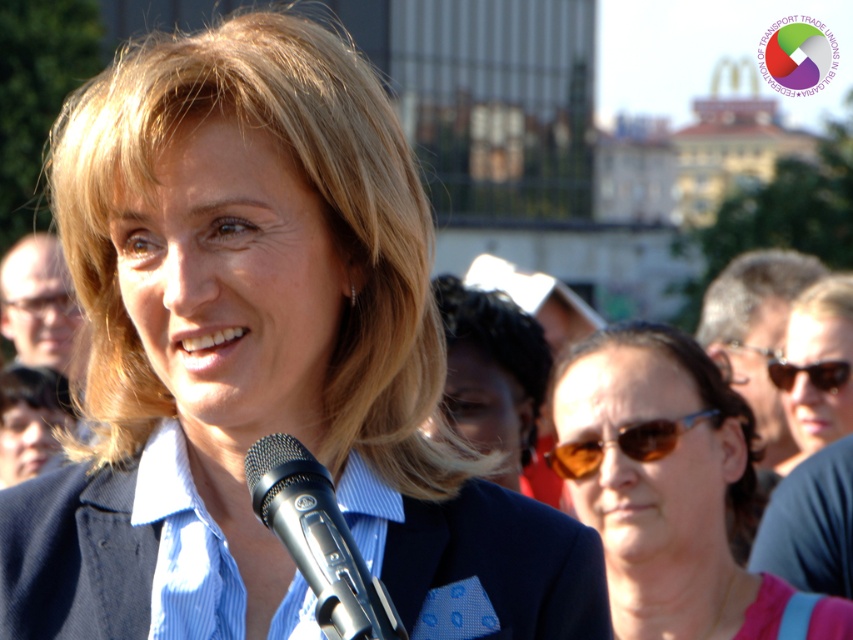
You are a photographer at the event and need to capture a clear shot of both the silver metallic microphone at center and the sunglasses at center. Which object should you focus on first if you want to ensure both are in focus without adjusting the camera settings?

The silver metallic microphone at center is not as tall as the sunglasses at center, so you should focus on the sunglasses at center first since it is taller and requires a closer focus point, ensuring the microphone will also be in focus when using a single plane of focus.

You are a photographer at the event and want to capture a clear shot of the speaker. The dark brown hair at center and shiny dark sunglasses at center are both in the frame. Which object should you focus on to ensure the subject is sharp, considering their size?

The dark brown hair at center is larger in size than the shiny dark sunglasses at center, so focusing on the dark brown hair at center would ensure the subject is sharp as it occupies more of the frame.

You are standing in the crowd at an outdoor event where a woman in a blue blazer is speaking into a black microphone. You want to get a better view of the speaker. The dark brown hair at center is blocking your view. Can you move to the left or right to avoid it?

The dark brown hair at center is located at coordinates point (492, 372). Since you can move either left or right, you can navigate around it to get a better view.